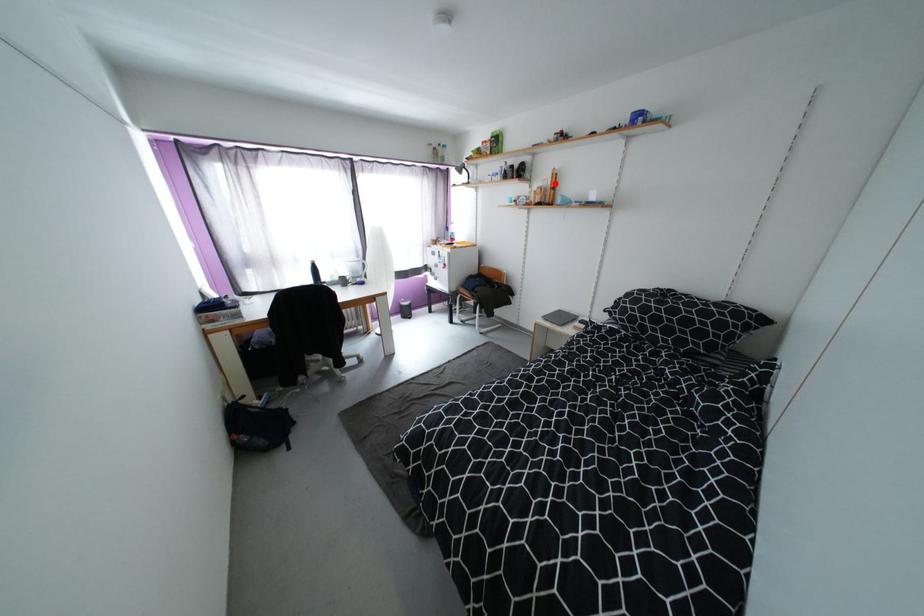
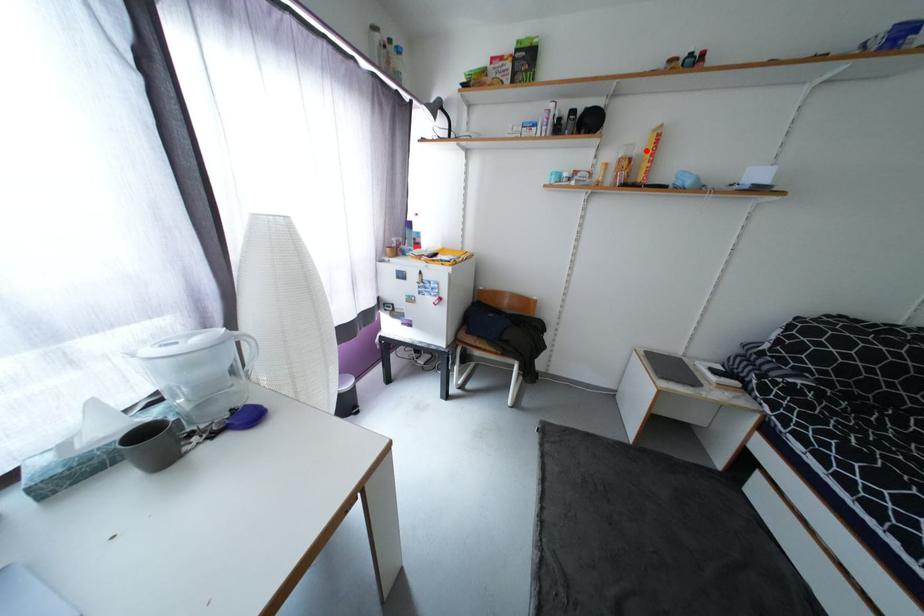
I am providing you with two images of the same scene from different viewpoints. A red point is marked on the first image and another point is marked on the second image. Do the highlighted points in image1 and image2 indicate the same real-world spot?

Yes